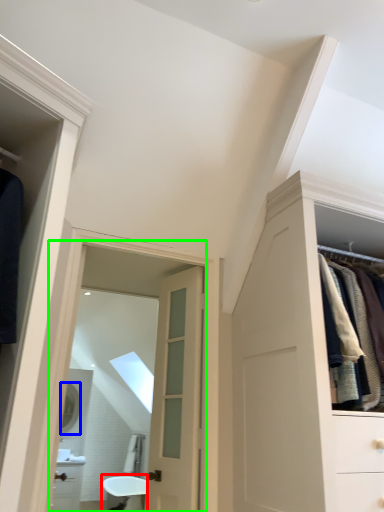
Question: Considering the real-world distances, which object is farthest from bath (highlighted by a red box)? mirror (highlighted by a blue box) or mirror (highlighted by a green box)?

Choices:
 (A) mirror
 (B) mirror

Answer: (A)